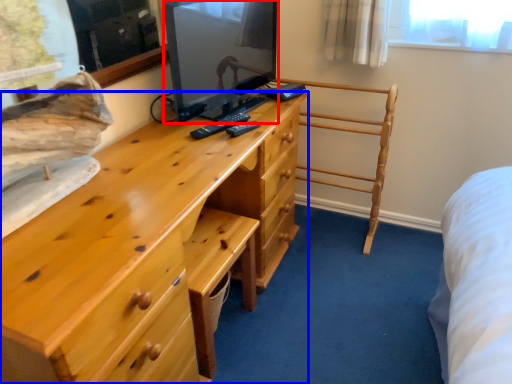
Question: Which object appears farthest to the camera in this image, television (highlighted by a red box) or chest of drawers (highlighted by a blue box)?

Choices:
 (A) television
 (B) chest of drawers

Answer: (A)